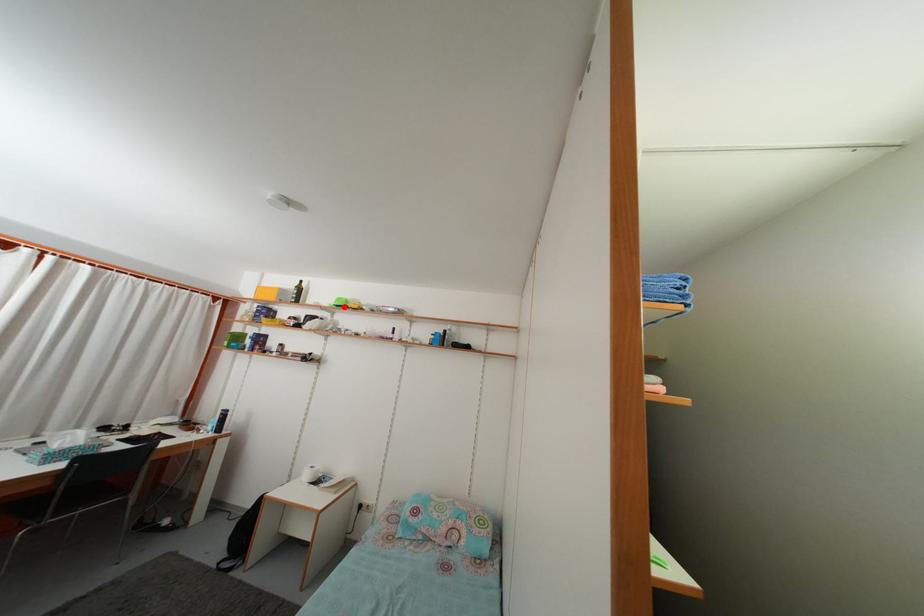
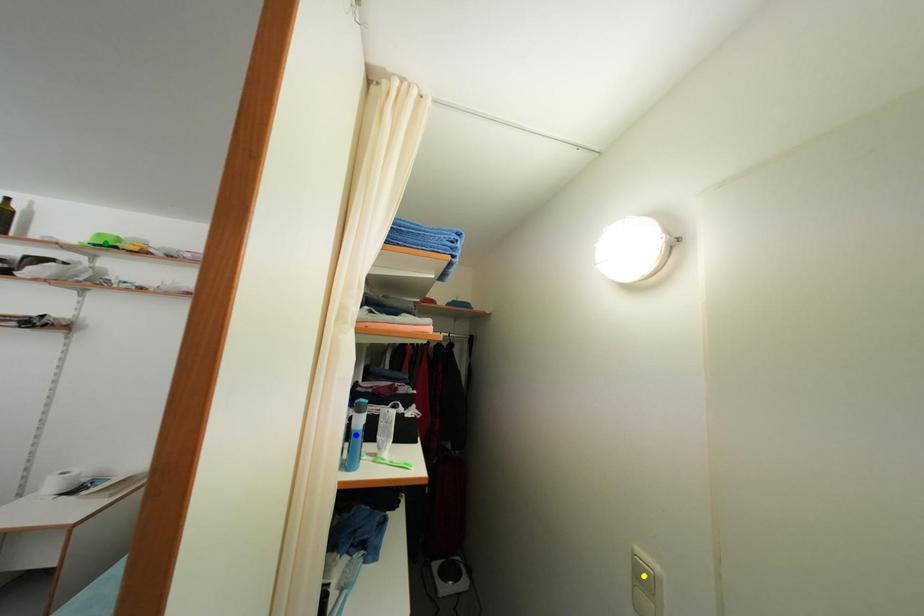
Question: I am providing you with two images of the same scene from different viewpoints. A red point is marked on the first image. You are given multiple points on the second image. Can you choose the point in image 2 that corresponds to the point in image 1?

Choices:
 (A) blue point
 (B) yellow point
 (C) green point

Answer: (C)